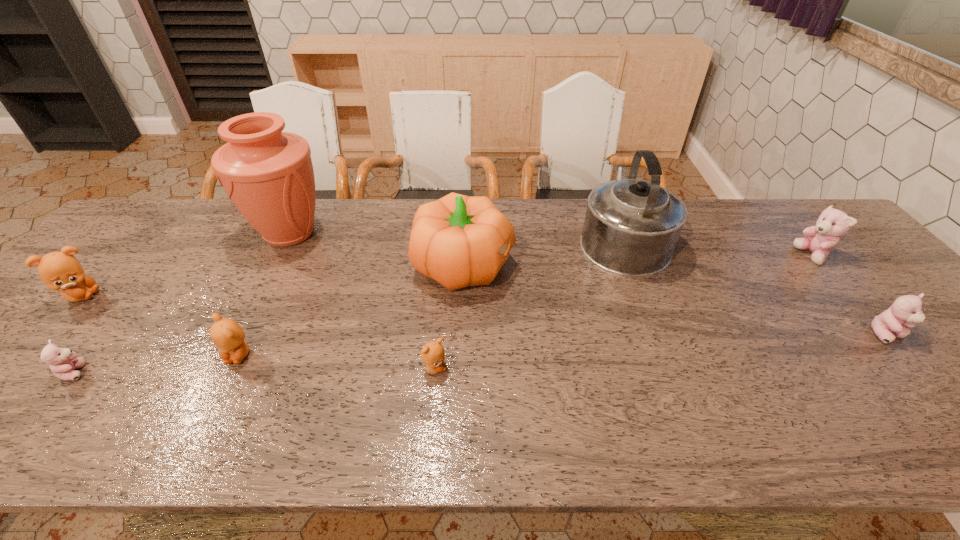
Locate an element on the screen. The image size is (960, 540). the third teddy bear from left to right is located at coordinates (227, 335).

Locate an element on the screen. The height and width of the screenshot is (540, 960). the second farthest pink teddy bear is located at coordinates (906, 310).

Identify the location of the rightmost brown teddy bear. This screenshot has width=960, height=540. (432, 354).

Where is `the fourth teddy bear from left to right`? This screenshot has height=540, width=960. the fourth teddy bear from left to right is located at coordinates (432, 354).

Find the location of a particular element. This screenshot has height=540, width=960. the fifth teddy bear from right to left is located at coordinates (64, 363).

At what (x,y) coordinates should I click in order to perform the action: click on the nearest pink teddy bear. Please return your answer as a coordinate pair (x, y). Looking at the image, I should click on (64, 363).

The image size is (960, 540). Identify the location of free region located on the left of the vase. (141, 234).

Locate an element on the screen. vacant space located on the carved face of the pumpkin is located at coordinates point(558,265).

The width and height of the screenshot is (960, 540). I want to click on blank space located 0.290m at the face of the farthest pink teddy bear, so click(x=695, y=255).

In order to click on vacant space located at the face of the farthest pink teddy bear in this screenshot , I will do `click(769, 255)`.